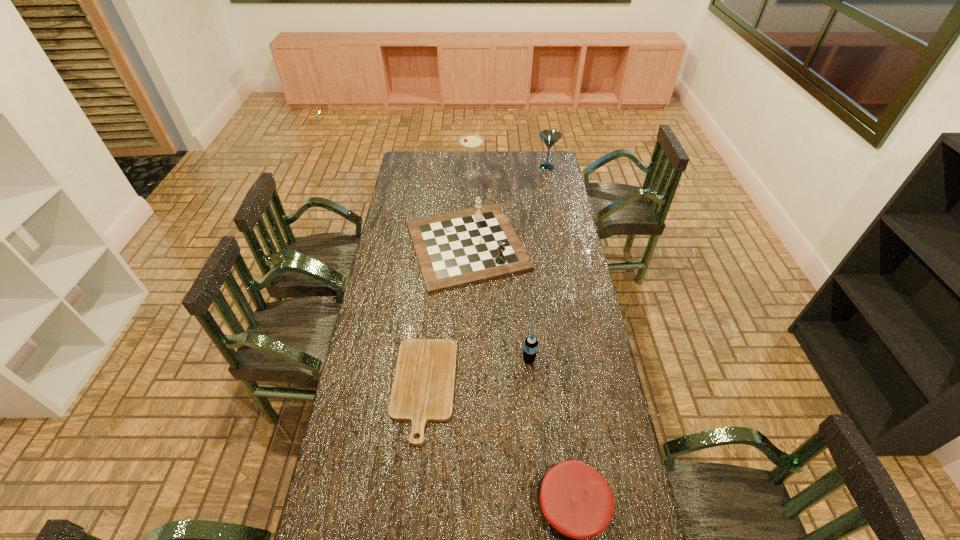
What are the coordinates of `the left martini` in the screenshot? It's located at (471, 142).

You are a GUI agent. You are given a task and a screenshot of the screen. Output one action in this format:
    pyautogui.click(x=<x>, y=<y>)
    Task: Click on the right martini
    
    Given the screenshot: What is the action you would take?
    pyautogui.click(x=549, y=137)

This screenshot has width=960, height=540. Identify the location of soda bottle. (530, 346).

Where is `the fourth nearest object`? This screenshot has height=540, width=960. the fourth nearest object is located at coordinates (454, 249).

The height and width of the screenshot is (540, 960). I want to click on chopping board, so click(423, 388).

I want to click on free space located on the front of the left martini, so click(470, 221).

I want to click on vacant space situated on the left of the right martini, so click(516, 166).

Find the location of a particular element. This screenshot has width=960, height=540. free region located on the right of the soda bottle is located at coordinates (589, 360).

You are a GUI agent. You are given a task and a screenshot of the screen. Output one action in this format:
    pyautogui.click(x=<x>, y=<y>)
    Task: Click on the vacant area situated 0.050m on the left of the gameboard
    
    Given the screenshot: What is the action you would take?
    (392, 245)

Where is `free space located on the back of the shortest object`? The height and width of the screenshot is (540, 960). free space located on the back of the shortest object is located at coordinates (433, 295).